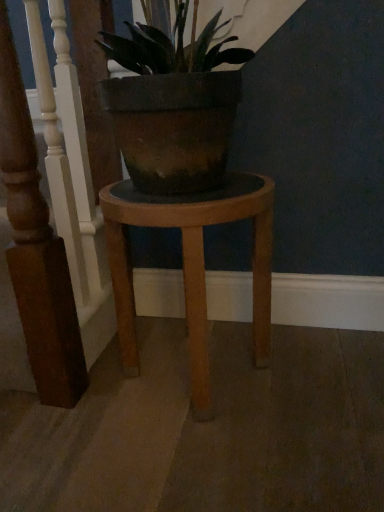
Question: Is wooden stool at center wider or thinner than white painted wood railing at left?

Choices:
 (A) wide
 (B) thin

Answer: (A)

Question: Is wooden stool at center in front of or behind white painted wood railing at left in the image?

Choices:
 (A) front
 (B) behind

Answer: (B)

Question: Based on their positions, is wooden stool at center located to the left or right of white painted wood railing at left?

Choices:
 (A) left
 (B) right

Answer: (B)

Question: From the image's perspective, relative to wooden stool at center, is white painted wood railing at left above or below?

Choices:
 (A) above
 (B) below

Answer: (A)

Question: From a real-world perspective, relative to wooden stool at center, is white painted wood railing at left vertically above or below?

Choices:
 (A) below
 (B) above

Answer: (B)

Question: In the image, is white painted wood railing at left positioned in front of or behind wooden stool at center?

Choices:
 (A) front
 (B) behind

Answer: (A)

Question: Visually, is white painted wood railing at left positioned to the left or to the right of wooden stool at center?

Choices:
 (A) right
 (B) left

Answer: (B)